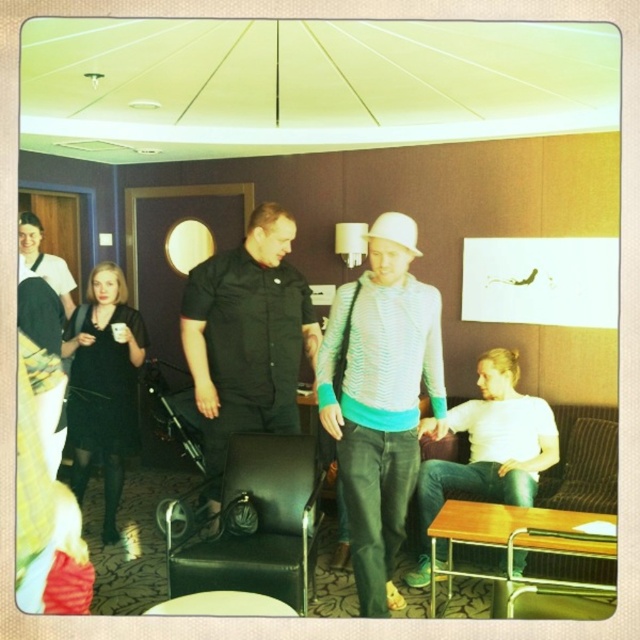
Between black matte chef's coat at center and white matte shirt at center, which one is positioned higher?

Positioned higher is black matte chef's coat at center.

Can you confirm if black matte chef's coat at center is thinner than white matte shirt at center?

Yes.

This screenshot has width=640, height=640. What are the coordinates of `black matte chef's coat at center` in the screenshot? It's located at (248, 337).

Does black matte chef's coat at center appear on the left side of white matte hat at center?

Yes, black matte chef's coat at center is to the left of white matte hat at center.

Does black matte chef's coat at center lie in front of white matte hat at center?

No, black matte chef's coat at center is further to the viewer.

Is point (268, 339) in front of point (408, 237)?

That is False.

Where is `black matte chef's coat at center`? Image resolution: width=640 pixels, height=640 pixels. black matte chef's coat at center is located at coordinates (248, 337).

Can you confirm if knitted sweater at center is bigger than white matte shirt at center?

No, knitted sweater at center is not bigger than white matte shirt at center.

Is knitted sweater at center positioned in front of white matte shirt at center?

Yes.

I want to click on knitted sweater at center, so click(380, 400).